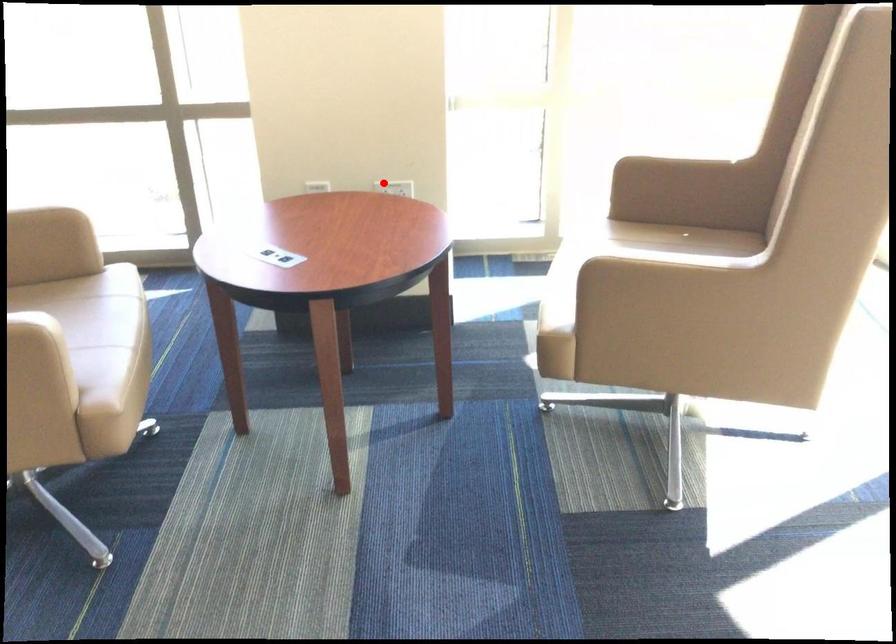
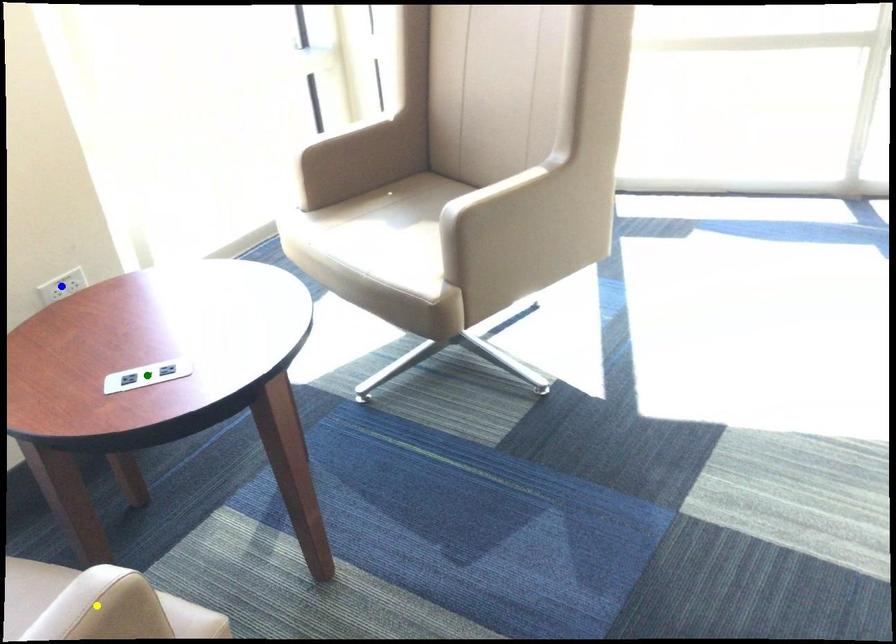
Question: I am providing you with two images of the same scene from different viewpoints. A red point is marked on the first image. You are given multiple points on the second image. In image 2, which mark is for the same physical point as the one in image 1?

Choices:
 (A) blue point
 (B) yellow point
 (C) green point

Answer: (A)